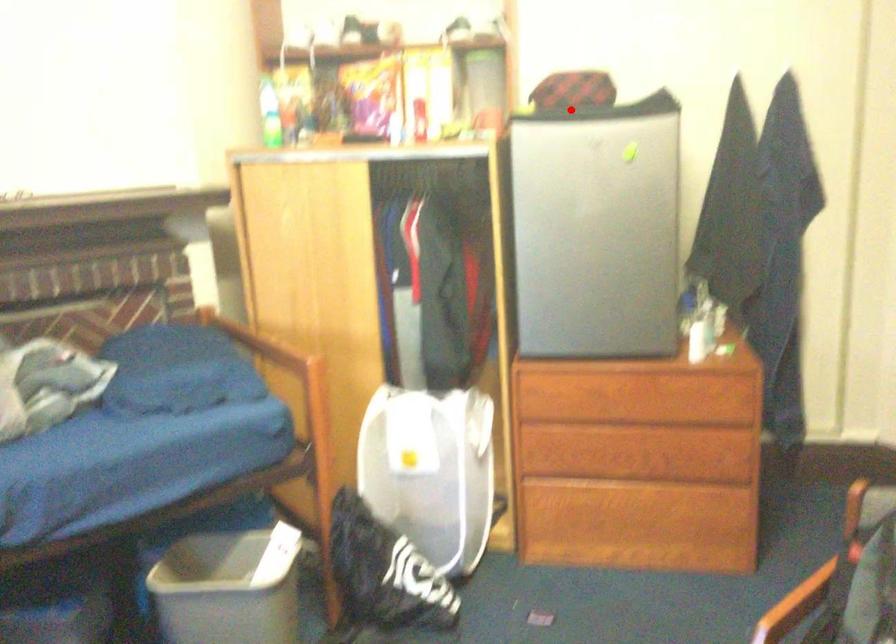
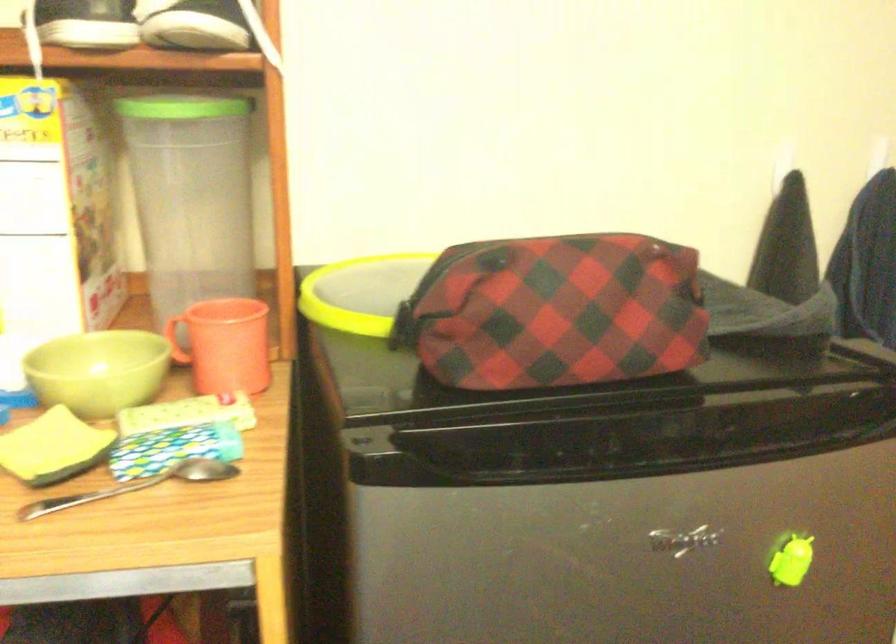
Question: I am providing you with two images of the same scene from different viewpoints. A red point is marked on the first image. Is the red point's position out of view in image 2?

Choices:
 (A) Yes
 (B) No

Answer: (B)